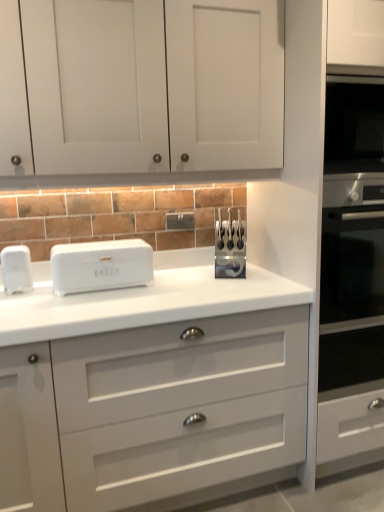
The height and width of the screenshot is (512, 384). I want to click on free space in front of white plastic bread bin at left, which appears as the first home appliance when viewed from the left, so click(x=24, y=297).